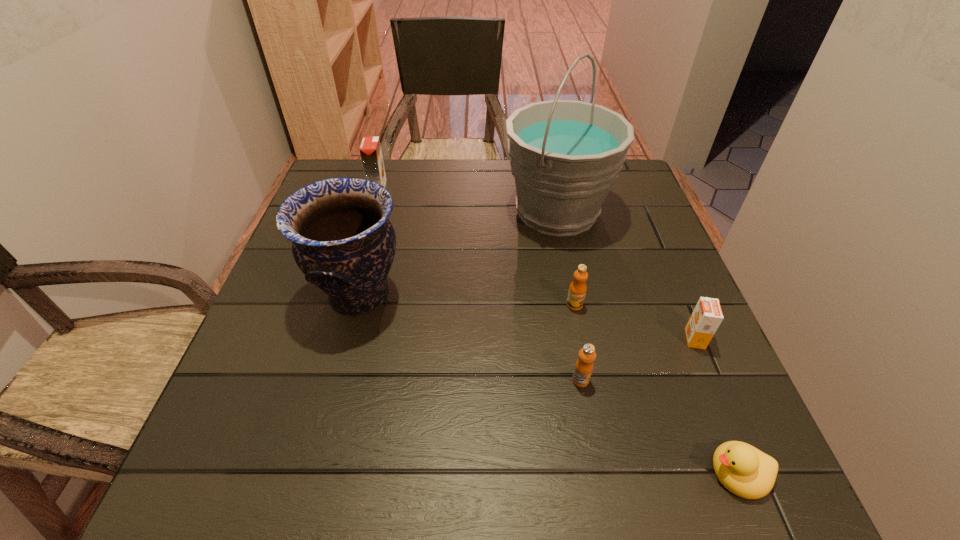
The image size is (960, 540). I want to click on free space that is in between the nearest object and the rightmost orange juice, so click(x=716, y=406).

The image size is (960, 540). Find the location of `free spot between the second tallest object and the rightmost orange juice`. free spot between the second tallest object and the rightmost orange juice is located at coordinates (527, 317).

Where is `object that ranks as the closest to the third tallest object`? The image size is (960, 540). object that ranks as the closest to the third tallest object is located at coordinates (342, 240).

Point out which object is positioned as the fourth nearest to the nearest orange juice. Please provide its 2D coordinates. Your answer should be formatted as a tuple, i.e. [(x, y)], where the tuple contains the x and y coordinates of a point satisfying the conditions above.

[(342, 240)]

The width and height of the screenshot is (960, 540). I want to click on the third closest orange juice to the duckling, so click(577, 290).

Select which orange juice appears as the closest to the farthest orange juice. Please provide its 2D coordinates. Your answer should be formatted as a tuple, i.e. [(x, y)], where the tuple contains the x and y coordinates of a point satisfying the conditions above.

[(577, 290)]

The image size is (960, 540). Find the location of `blank space that satisfies the following two spatial constraints: 1. on the front side of the rightmost orange juice; 2. on the face of the shortest object`. blank space that satisfies the following two spatial constraints: 1. on the front side of the rightmost orange juice; 2. on the face of the shortest object is located at coordinates (752, 472).

I want to click on vacant space that satisfies the following two spatial constraints: 1. on the front label of the third nearest orange juice; 2. on the right side of the second nearest orange juice, so click(581, 339).